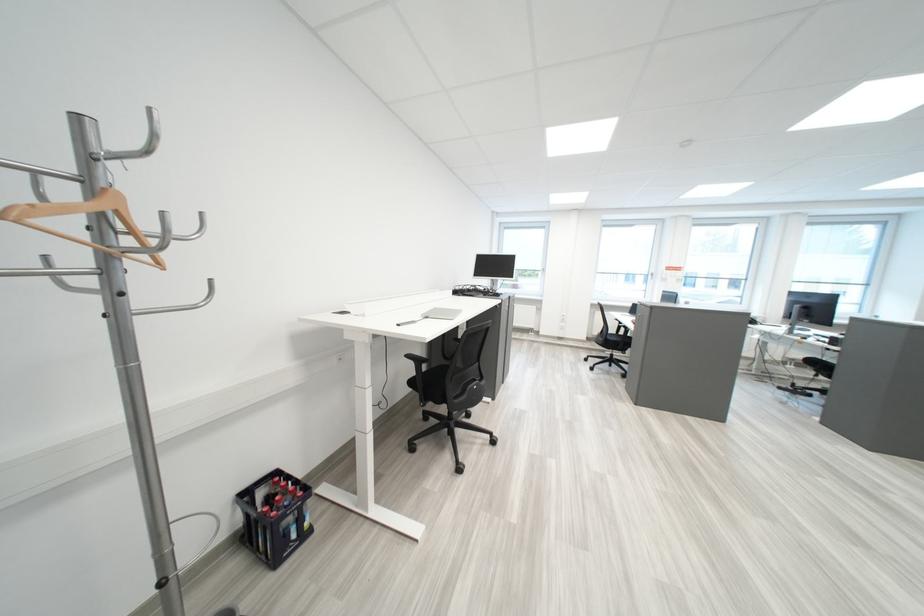
What are the coordinates of `black pen` in the screenshot? It's located at (409, 322).